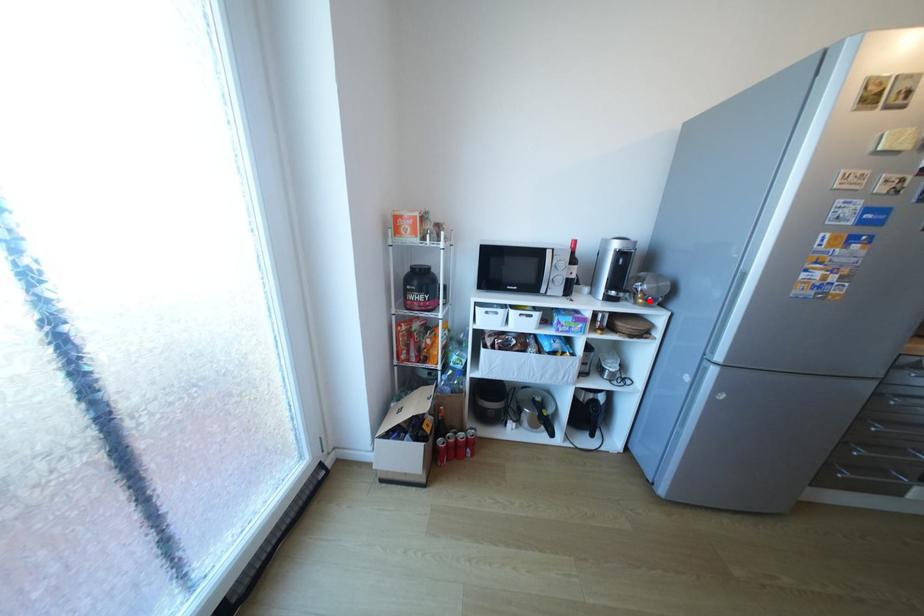
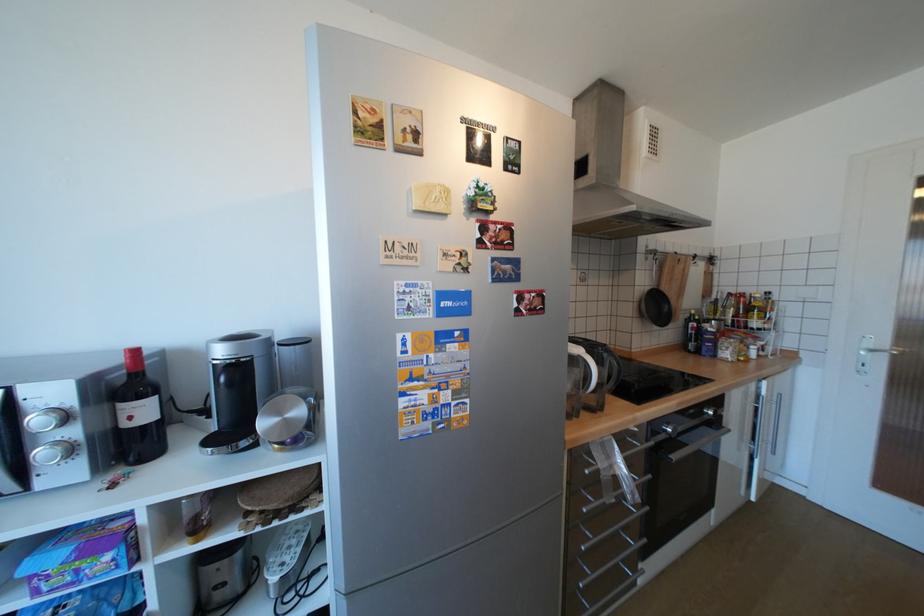
Question: I am providing you with two images of the same scene from different viewpoints. A red point is shown in image1. For the corresponding object point in image2, is it positioned nearer or farther from the camera?

Choices:
 (A) Nearer
 (B) Farther

Answer: (B)